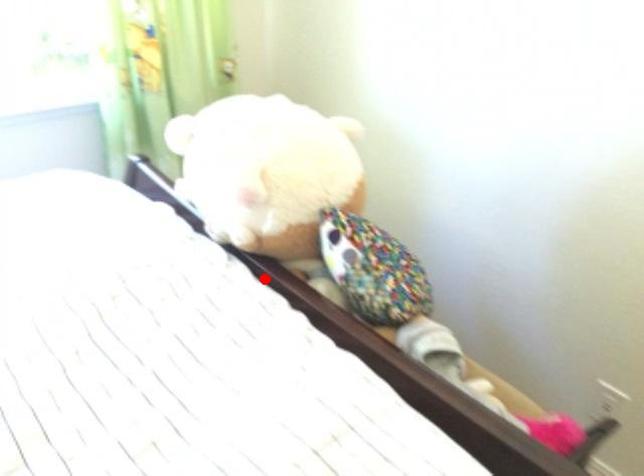
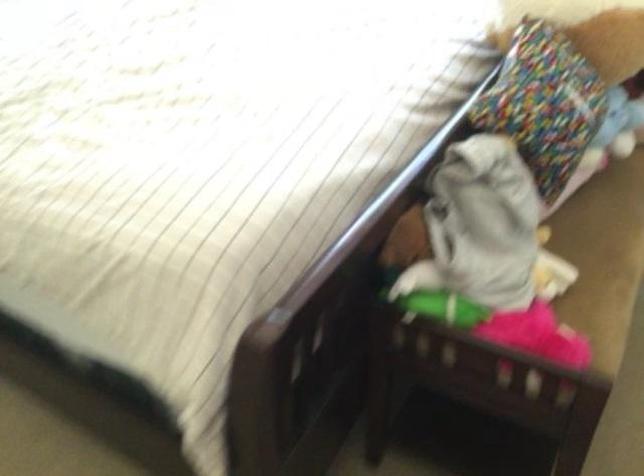
In the second image, find the point that corresponds to the highlighted location in the first image.

(468, 76)